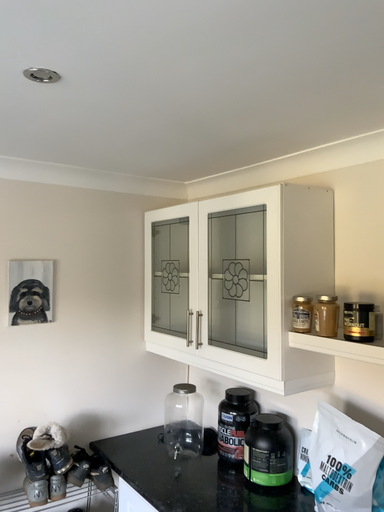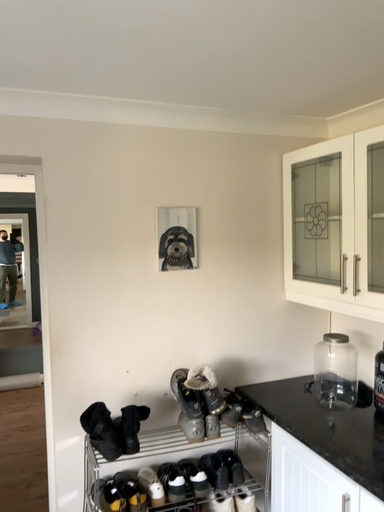
Question: Which way did the camera rotate in the video?

Choices:
 (A) rotated right
 (B) rotated left

Answer: (B)